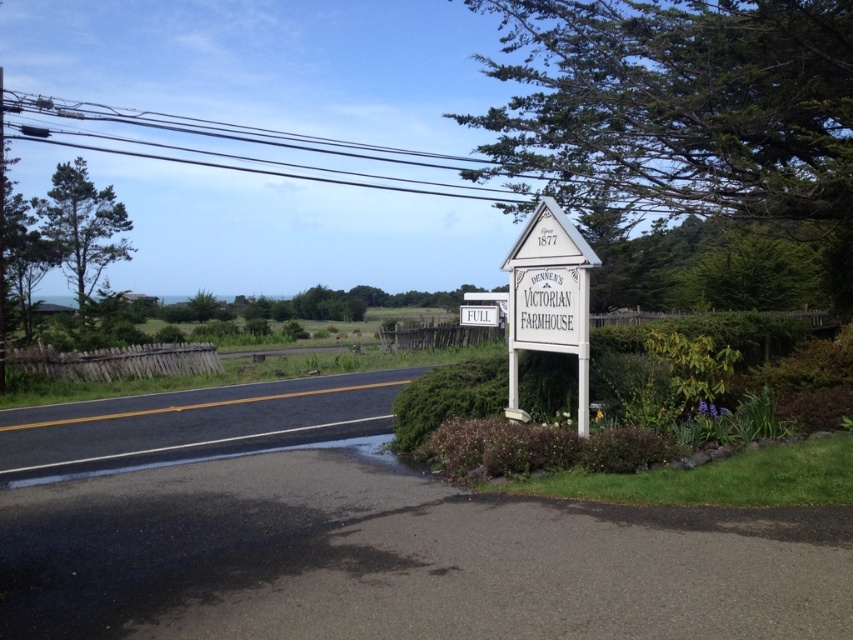
Does white wooden sign at center have a greater height compared to white matte sign at center?

Yes, white wooden sign at center is taller than white matte sign at center.

Can you confirm if white wooden sign at center is wider than white matte sign at center?

No, white wooden sign at center is not wider than white matte sign at center.

Between point (556, 253) and point (482, 307), which one is positioned in front?

Point (556, 253) is more forward.

The image size is (853, 640). I want to click on white wooden sign at center, so click(549, 296).